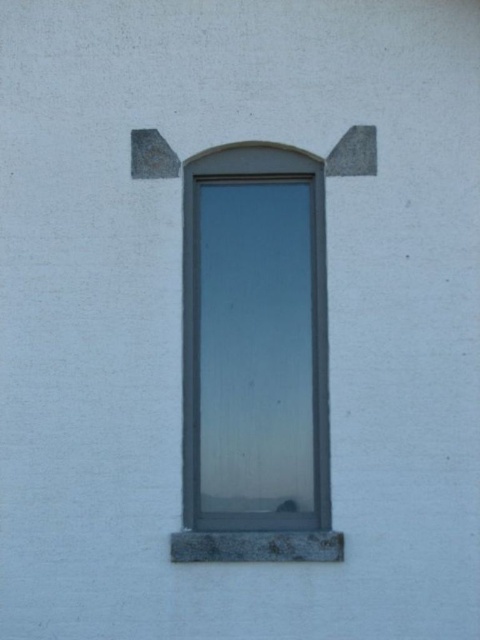
You are an architect designing a new building and want to ensure proper proportions between the gray stone window frame at center and the gray stone window sill at lower center. Based on the image, which object is taller?

The gray stone window frame at center is taller than the gray stone window sill at lower center according to the description.

You are standing at the point marked as point (295, 388) in a room with the window described. If you want to take a photo of the window from your current position, will you be able to capture the entire window in the frame without moving? The camera you are using has a standard field of view of 60 degrees.

The point (295, 388) is 14.51 feet away from the camera. To determine if the entire window can be captured, we need to calculate the angle of view required. Assuming the window height is H, the angle would be 2 times arctangent of H divided by twice the distance. However, without knowing the window dimensions, we can only state the distance. Since the question provides the distance but not the window size, we cannot definitively answer if the entire window fits within the 60 degree field of view. More inf

You are an architect designing a new building and want to ensure proper structural support. Considering the image of the window, which object between the gray stone window frame at center and the gray stone window sill at lower center is wider and thus might require more reinforcement?

The gray stone window sill at lower center is wider than the gray stone window frame at center, so it might require more reinforcement.